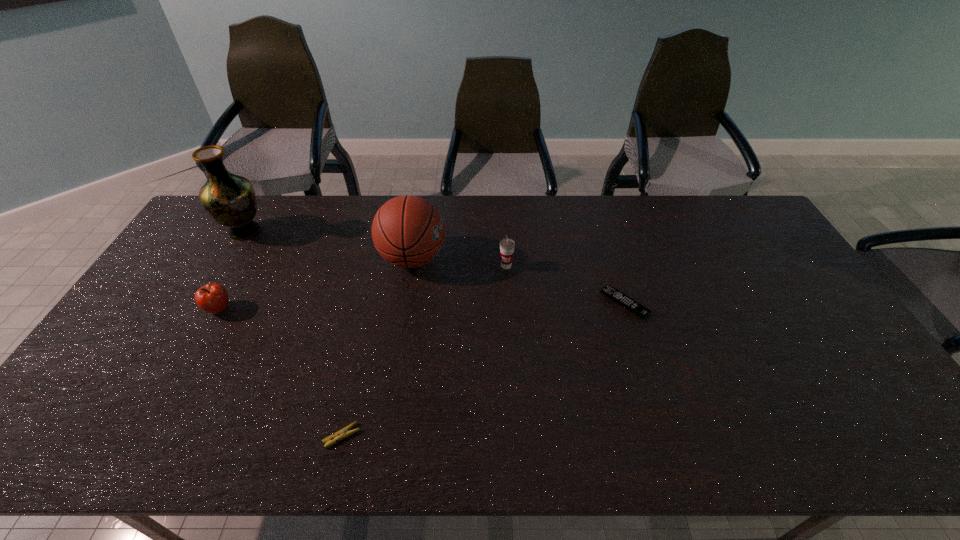
This screenshot has width=960, height=540. I want to click on vacant area that lies between the basketball and the clothespin, so click(x=377, y=347).

The height and width of the screenshot is (540, 960). I want to click on vacant area that lies between the rightmost object and the fourth tallest object, so click(x=421, y=306).

Locate which object is the fifth closest to the third shortest object. Please provide its 2D coordinates. Your answer should be formatted as a tuple, i.e. [(x, y)], where the tuple contains the x and y coordinates of a point satisfying the conditions above.

[(639, 310)]

Where is `object that stands as the second closest to the vase`? Image resolution: width=960 pixels, height=540 pixels. object that stands as the second closest to the vase is located at coordinates (408, 231).

Image resolution: width=960 pixels, height=540 pixels. What are the coordinates of `vacant space that satisfies the following two spatial constraints: 1. on the logo side of the second tallest object; 2. on the left side of the rightmost object` in the screenshot? It's located at (406, 303).

Where is `vacant space that satisfies the following two spatial constraints: 1. on the back side of the rightmost object; 2. on the right side of the nearest object`? The image size is (960, 540). vacant space that satisfies the following two spatial constraints: 1. on the back side of the rightmost object; 2. on the right side of the nearest object is located at coordinates (372, 303).

Where is `free space that satisfies the following two spatial constraints: 1. on the side of the second object from right to left with the logo; 2. on the right side of the rightmost object`? The width and height of the screenshot is (960, 540). free space that satisfies the following two spatial constraints: 1. on the side of the second object from right to left with the logo; 2. on the right side of the rightmost object is located at coordinates (509, 303).

Locate an element on the screen. blank space that satisfies the following two spatial constraints: 1. on the side of the second object from right to left with the logo; 2. on the right side of the remote control is located at coordinates (509, 303).